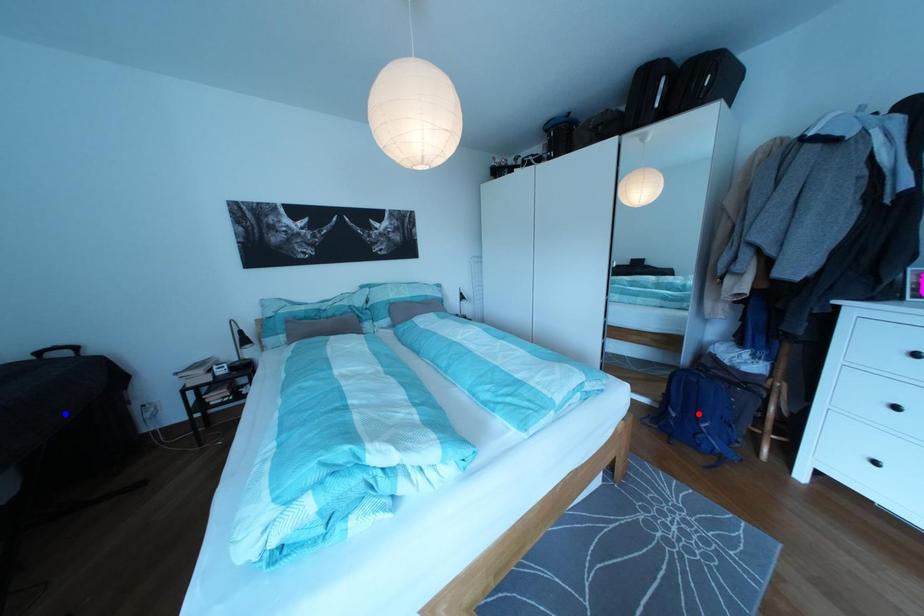
Question: In the image, two points are highlighted. Which point is nearer to the camera? Reply with the corresponding letter.

Choices:
 (A) blue point
 (B) red point

Answer: (A)